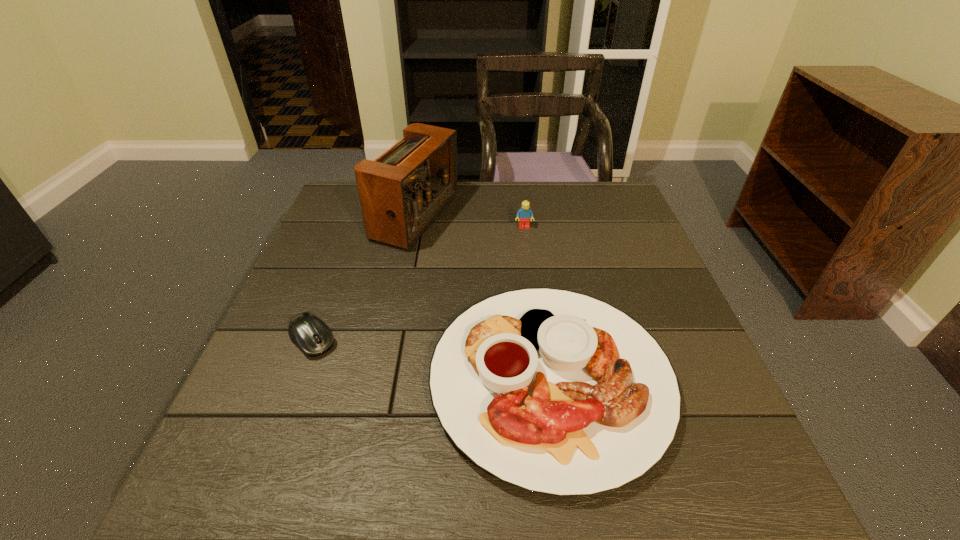
You are a GUI agent. You are given a task and a screenshot of the screen. Output one action in this format:
    pyautogui.click(x=<x>, y=<y>)
    Task: Click on the free spot that satisfies the following two spatial constraints: 1. on the front side of the platter; 2. on the right side of the mouse
    
    Given the screenshot: What is the action you would take?
    pyautogui.click(x=299, y=380)

Locate an element on the screen. Image resolution: width=960 pixels, height=540 pixels. blank space that satisfies the following two spatial constraints: 1. on the front side of the platter; 2. on the left side of the tallest object is located at coordinates click(383, 380).